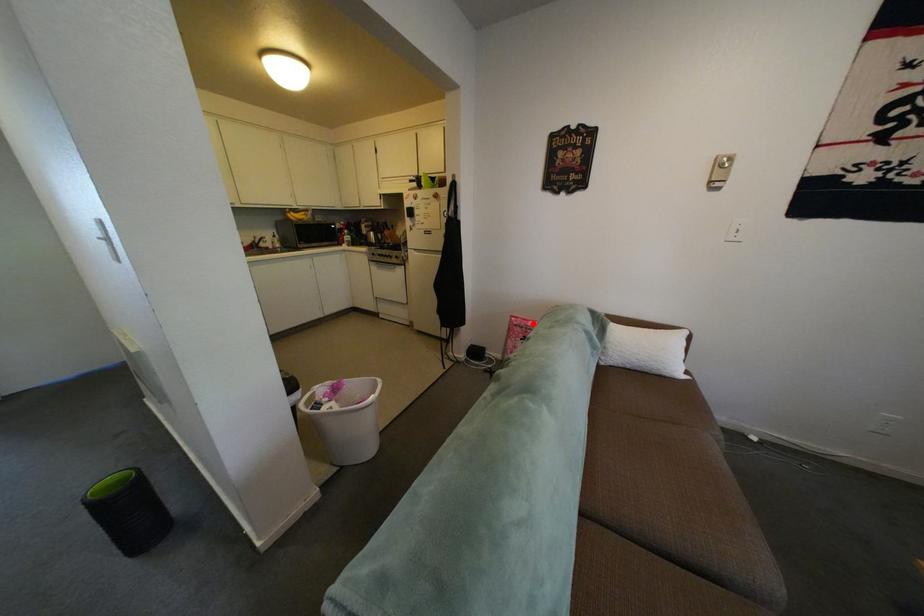
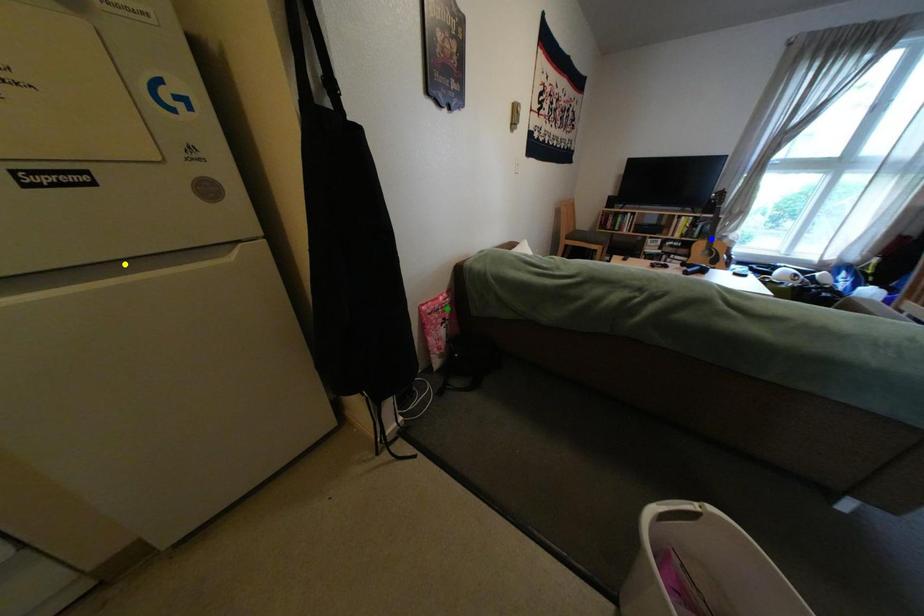
Question: I am providing you with two images of the same scene from different viewpoints. A red point is marked on the first image. You are given multiple points on the second image. Which mark in image 2 goes with the point in image 1?

Choices:
 (A) green point
 (B) blue point
 (C) yellow point

Answer: (A)